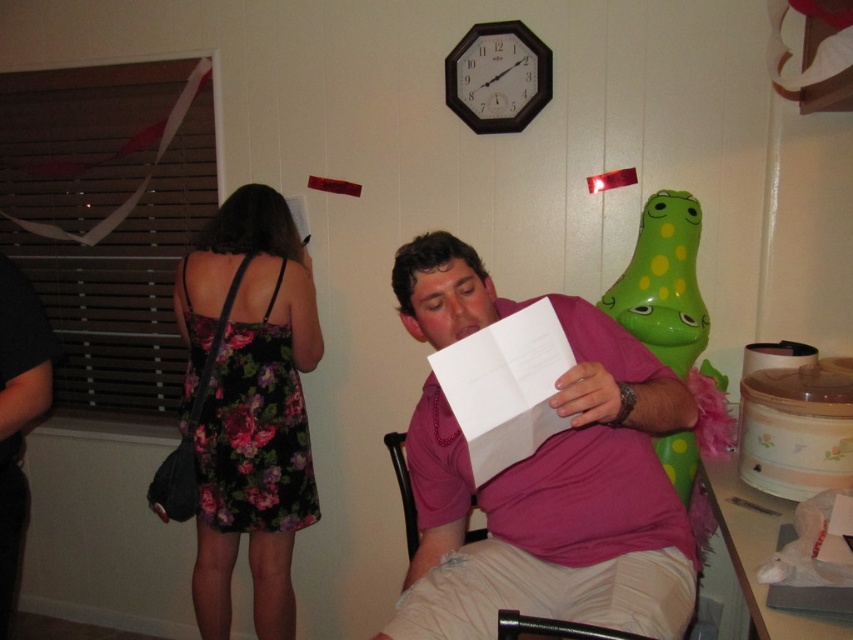
Question: Which object appears closest to the camera in this image?

Choices:
 (A) metallic black chair at lower center
 (B) wooden chair at center
 (C) floral dress at left
 (D) green rubber duck at right

Answer: (A)

Question: Considering the real-world distances, which object is closest to the pink matte shirt at center?

Choices:
 (A) metallic black chair at lower center
 (B) green rubber duck at right
 (C) black plastic clock at upper center

Answer: (A)

Question: Is floral dress at left bigger than green rubber duck at right?

Choices:
 (A) no
 (B) yes

Answer: (B)

Question: Estimate the real-world distances between objects in this image. Which object is closer to the metallic black chair at lower center?

Choices:
 (A) black plastic clock at upper center
 (B) green rubber duck at right

Answer: (B)

Question: Does green rubber duck at right have a smaller size compared to metallic black chair at lower center?

Choices:
 (A) yes
 (B) no

Answer: (B)

Question: Is green rubber duck at right smaller than black plastic clock at upper center?

Choices:
 (A) yes
 (B) no

Answer: (B)